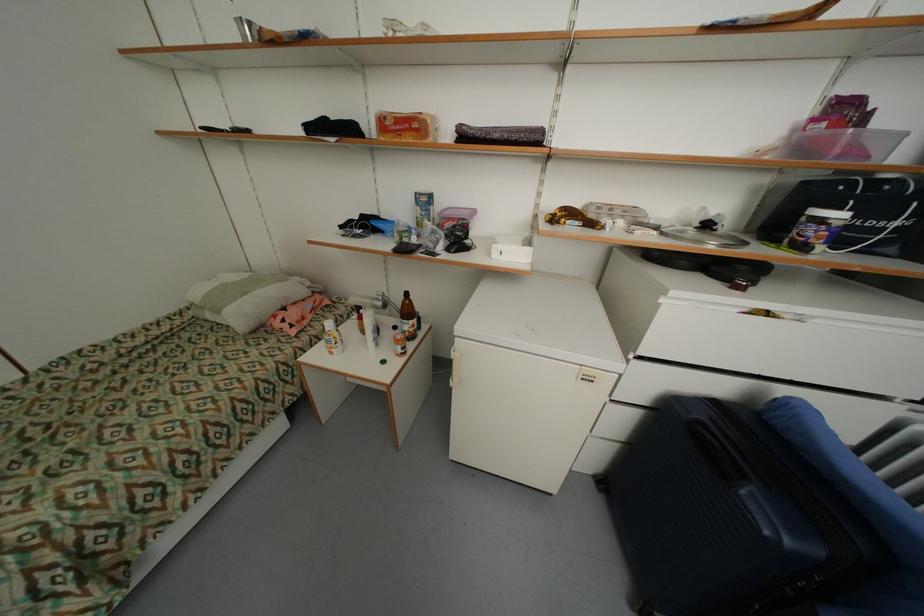
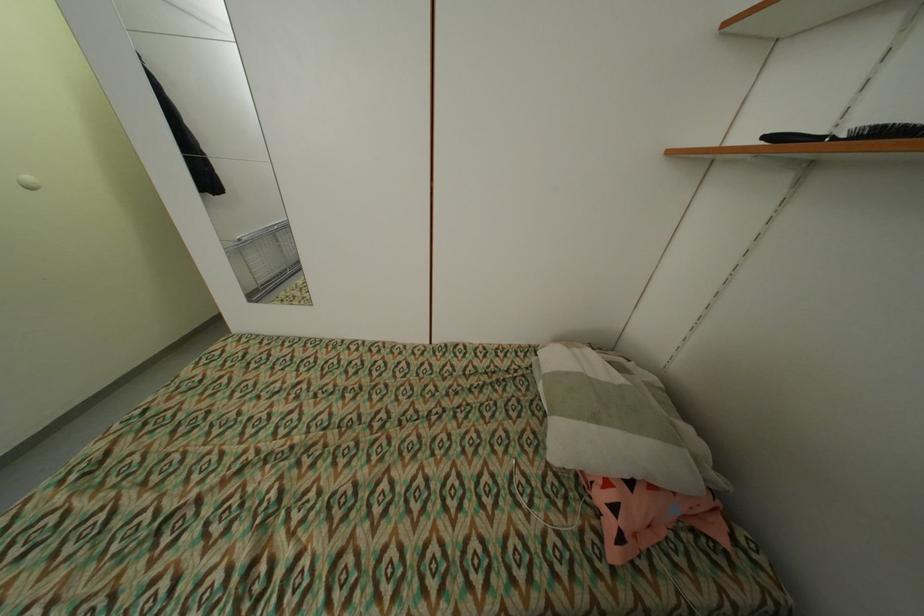
Based on the photo, how did the camera likely rotate?

The rotation direction of the camera is left-down.